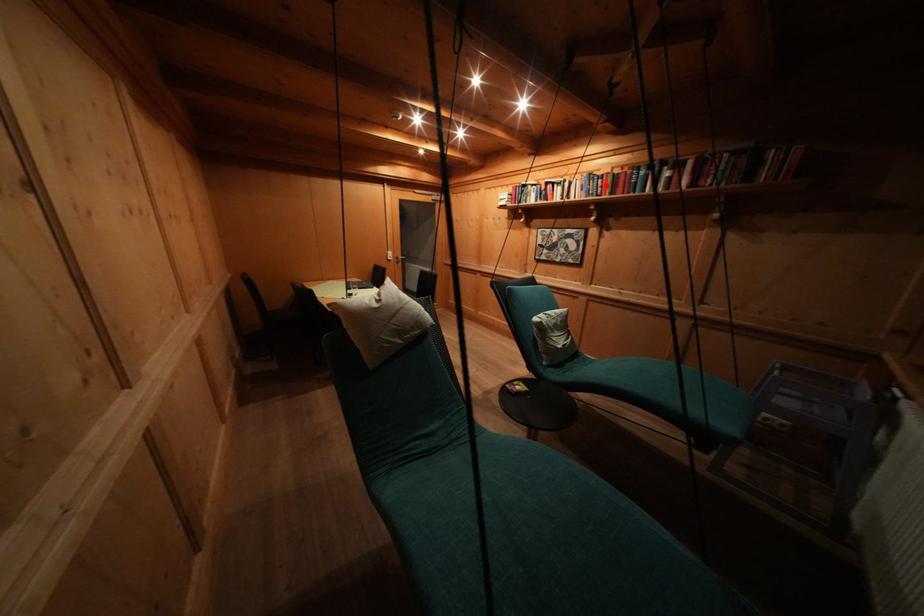
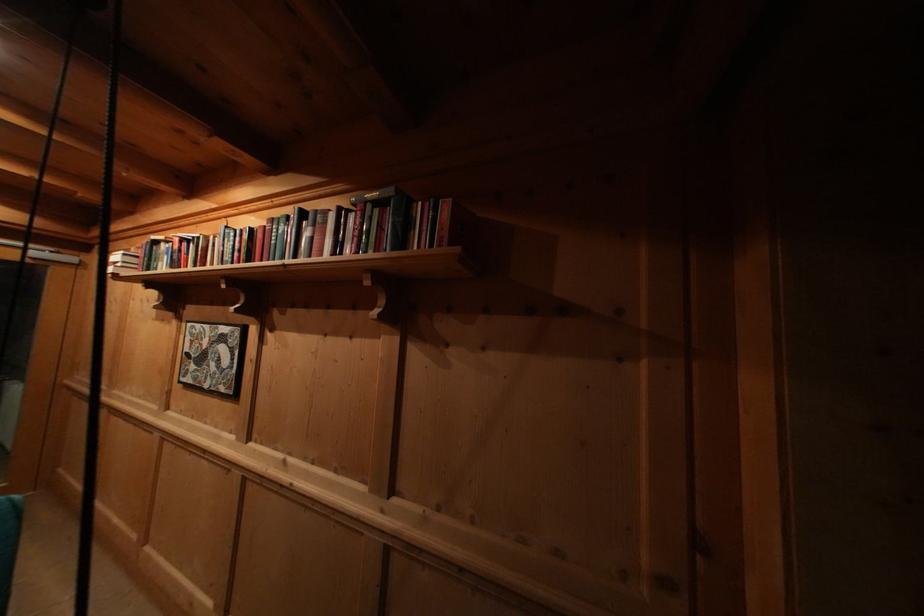
Where in the second image is the point corresponding to the highlighted location from the first image?

(244, 245)